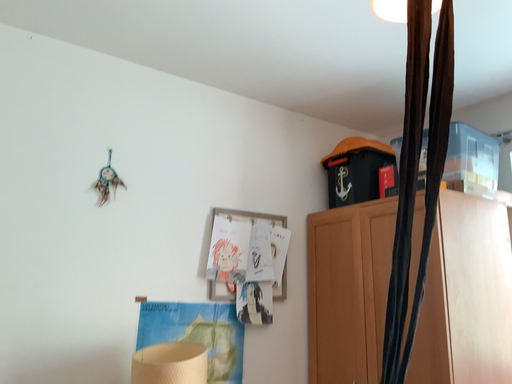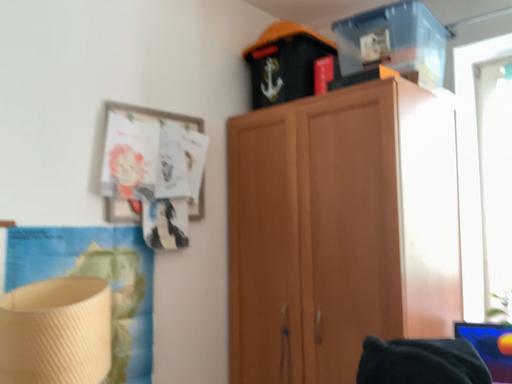
Question: How did the camera likely rotate when shooting the video?

Choices:
 (A) rotated upward
 (B) rotated downward

Answer: (B)